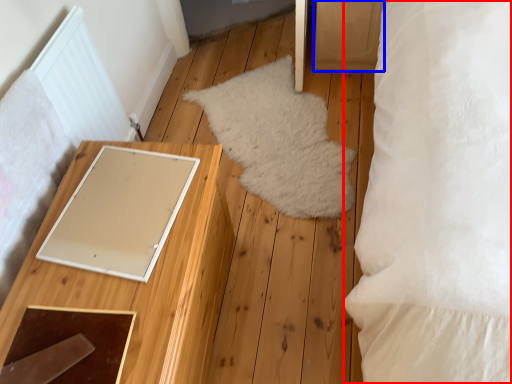
Question: Which point is further to the camera, pillow (highlighted by a red box) or drawer (highlighted by a blue box)?

Choices:
 (A) pillow
 (B) drawer

Answer: (B)